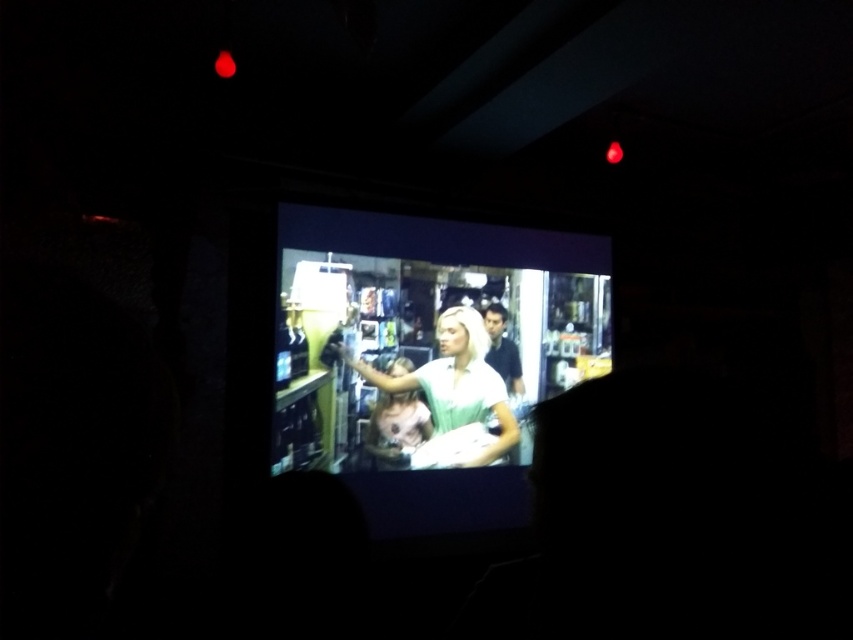
You are sitting in the dark room and want to adjust your position so that you can see both the matte plastic screen at center and the matte white shirt at center clearly. Since the screen is taller than the shirt, which object will require you to look upwards more?

The matte plastic screen at center is taller than the matte white shirt at center, so you will need to look upwards more to see the matte plastic screen at center.

You are a movie theater employee who needs to adjust the distance between the matte plastic screen at center and the smooth white shirt at center. The recommended distance for optimal viewing is 35 centimeters. Can you confirm if the current distance meets the requirement?

The distance between the matte plastic screen at center and the smooth white shirt at center is 34.82 centimeters, which is just below the recommended 35 centimeters. Therefore, the current distance is slightly less than the requirement.